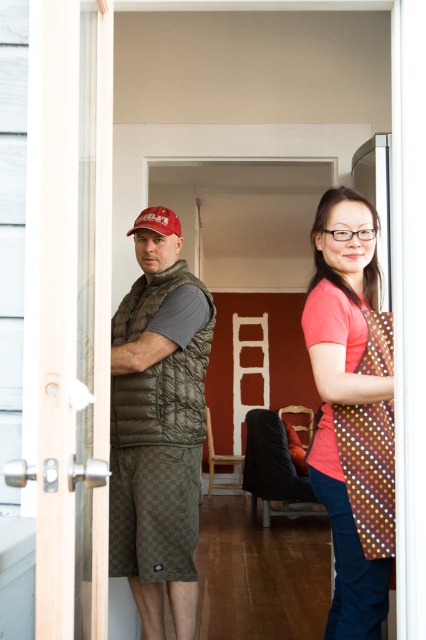
Is quilted olive vest at center further to camera compared to matte red baseball cap at left?

No, quilted olive vest at center is in front of matte red baseball cap at left.

Can you confirm if quilted olive vest at center is taller than matte red baseball cap at left?

Indeed, quilted olive vest at center has a greater height compared to matte red baseball cap at left.

This screenshot has width=426, height=640. In order to click on quilted olive vest at center in this screenshot , I will do `click(158, 432)`.

Identify the location of quilted olive vest at center. click(x=158, y=432).

Can you confirm if polka dot apron at right is thinner than brown dotted fabric apron at right?

Incorrect, polka dot apron at right's width is not less than brown dotted fabric apron at right's.

Identify the location of polka dot apron at right. (351, 410).

Image resolution: width=426 pixels, height=640 pixels. Identify the location of polka dot apron at right. (351, 410).

Can you confirm if brown dotted fabric apron at right is positioned below matte red baseball cap at left?

Indeed, brown dotted fabric apron at right is positioned under matte red baseball cap at left.

The height and width of the screenshot is (640, 426). Find the location of `brown dotted fabric apron at right`. brown dotted fabric apron at right is located at coordinates (368, 470).

Locate an element on the screen. brown dotted fabric apron at right is located at coordinates (368, 470).

Locate an element on the screen. The image size is (426, 640). brown dotted fabric apron at right is located at coordinates (368, 470).